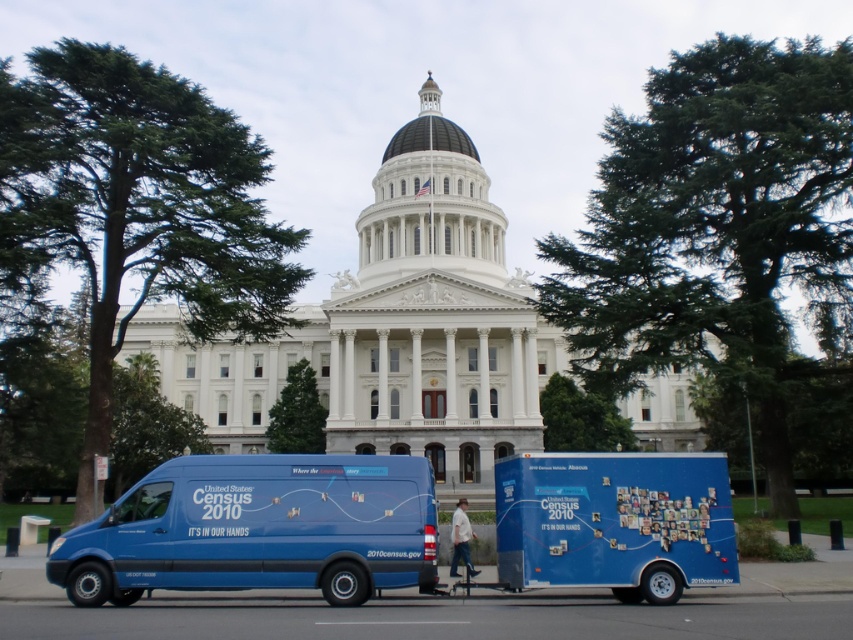
Question: Which object is farther from the camera taking this photo?

Choices:
 (A) blue matte trailer at lower right
 (B) blue matte van at center

Answer: (A)

Question: Is blue matte van at center positioned before blue matte trailer at lower right?

Choices:
 (A) yes
 (B) no

Answer: (A)

Question: Does blue matte van at center have a lesser width compared to blue matte trailer at lower right?

Choices:
 (A) yes
 (B) no

Answer: (B)

Question: Does blue matte van at center appear over blue matte trailer at lower right?

Choices:
 (A) no
 (B) yes

Answer: (A)

Question: Which object appears farthest from the camera in this image?

Choices:
 (A) blue matte van at center
 (B) blue matte trailer at lower right

Answer: (B)